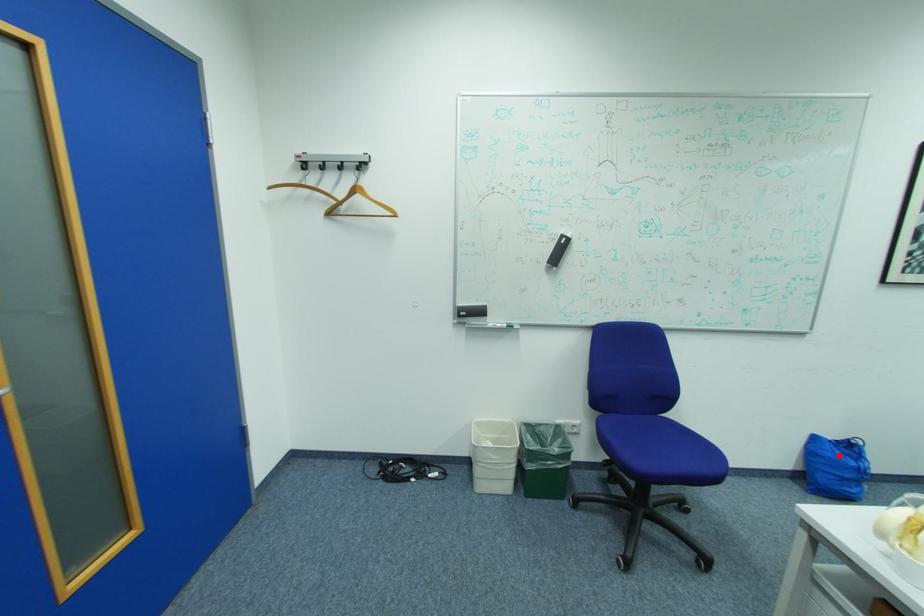
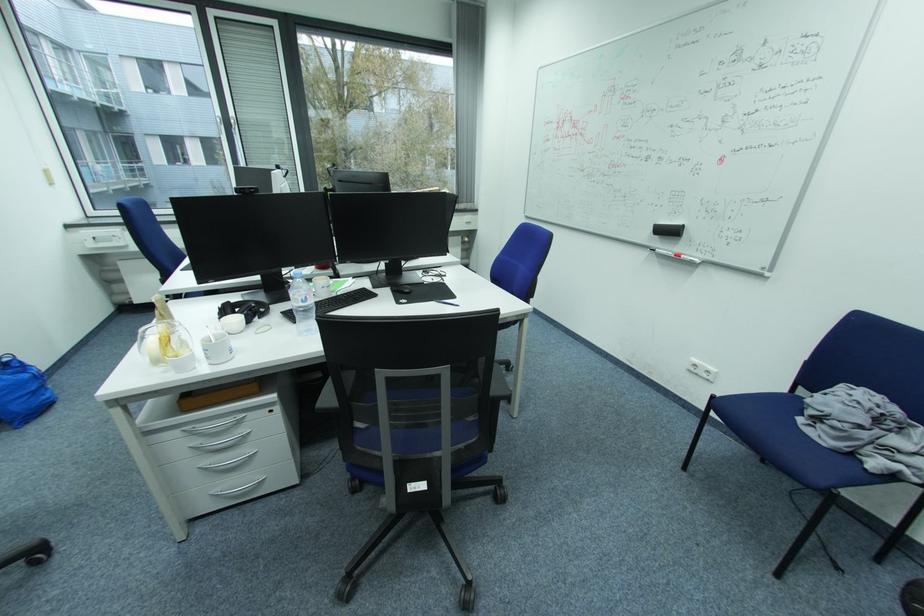
Question: A red point is marked in image1. In image2, is the corresponding 3D point closer to the camera or farther? Reply with the corresponding letter.

Choices:
 (A) The corresponding 3D point is closer.
 (B) The corresponding 3D point is farther.

Answer: (A)